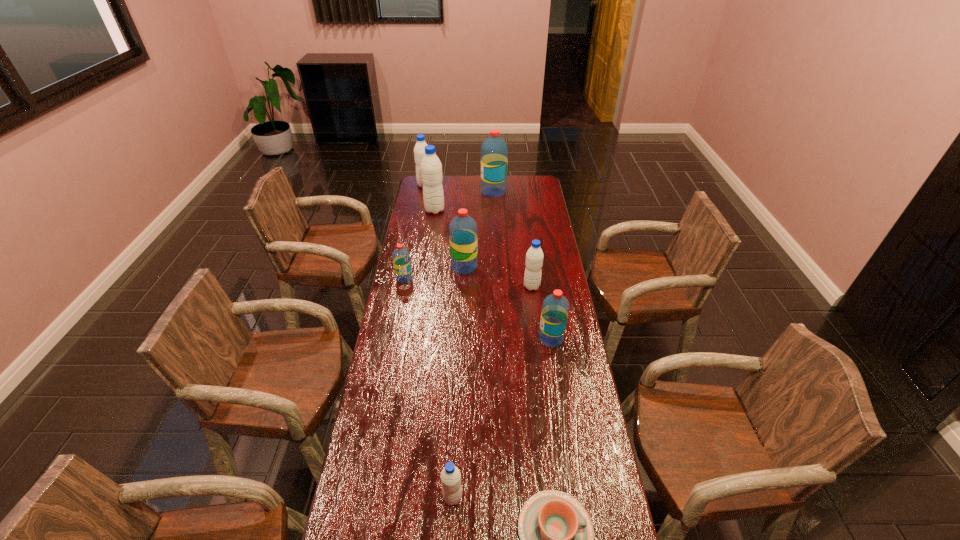
The image size is (960, 540). In order to click on the second red water bottle from right to left in this screenshot , I will do `click(494, 151)`.

You are a GUI agent. You are given a task and a screenshot of the screen. Output one action in this format:
    pyautogui.click(x=<x>, y=<y>)
    Task: Click on the farthest red water bottle
    This screenshot has width=960, height=540.
    Given the screenshot: What is the action you would take?
    tap(494, 151)

At what (x,y) coordinates should I click in order to perform the action: click on the second farthest gray water bottle. Please return your answer as a coordinate pair (x, y). This screenshot has height=540, width=960. Looking at the image, I should click on (431, 168).

Locate an element on the screen. This screenshot has width=960, height=540. the biggest gray water bottle is located at coordinates (431, 168).

The image size is (960, 540). What are the coordinates of `the farthest gray water bottle` in the screenshot? It's located at (419, 150).

The width and height of the screenshot is (960, 540). Identify the location of the third smallest red water bottle. [462, 229].

The image size is (960, 540). In order to click on the third biggest gray water bottle in this screenshot , I will do `click(534, 257)`.

The width and height of the screenshot is (960, 540). I want to click on the rightmost gray water bottle, so click(x=534, y=257).

Find the location of a particular element. The height and width of the screenshot is (540, 960). the second smallest red water bottle is located at coordinates (555, 308).

You are a GUI agent. You are given a task and a screenshot of the screen. Output one action in this format:
    pyautogui.click(x=<x>, y=<y>)
    Task: Click on the nearest red water bottle
    
    Given the screenshot: What is the action you would take?
    pyautogui.click(x=555, y=308)